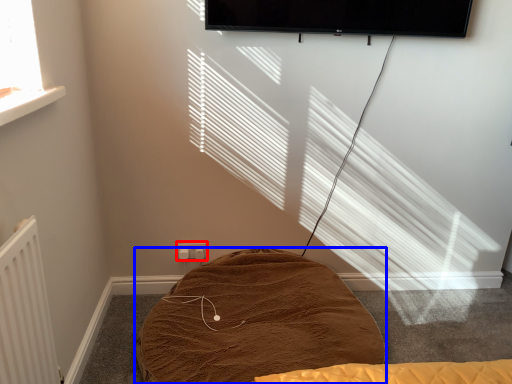
Question: Which of the following is the farthest to the observer, electric outlet (highlighted by a red box) or furniture (highlighted by a blue box)?

Choices:
 (A) electric outlet
 (B) furniture

Answer: (A)